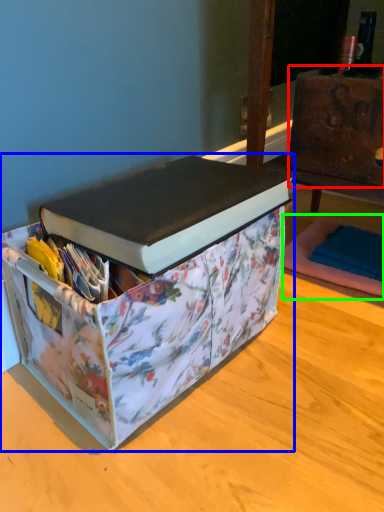
Question: Which is farther away from cardboard box (highlighted by a red box)? box (highlighted by a blue box) or yoga mat (highlighted by a green box)?

Choices:
 (A) box
 (B) yoga mat

Answer: (A)